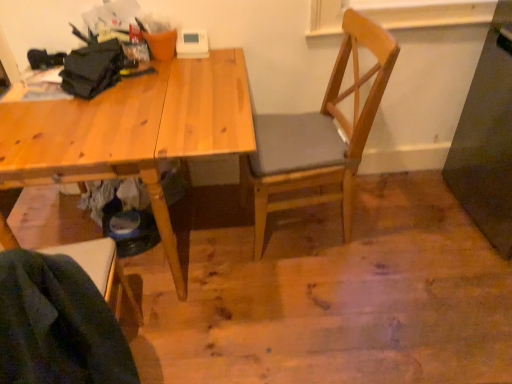
Locate an element on the screen. This screenshot has height=384, width=512. vacant space in natural wood desk at upper left (from a real-world perspective) is located at coordinates (182, 242).